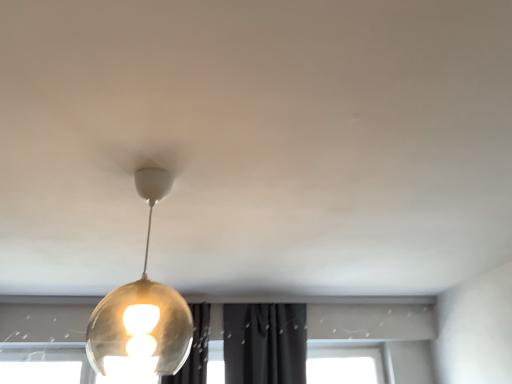
What are the coordinates of `translucent glass globe at center` in the screenshot? It's located at (141, 313).

Describe the element at coordinates (141, 313) in the screenshot. I see `translucent glass globe at center` at that location.

In order to face translucent glass globe at center, should I rotate leftwards or rightwards?

It's best to rotate left around 15.386 degrees.

The image size is (512, 384). I want to click on translucent glass globe at center, so click(141, 313).